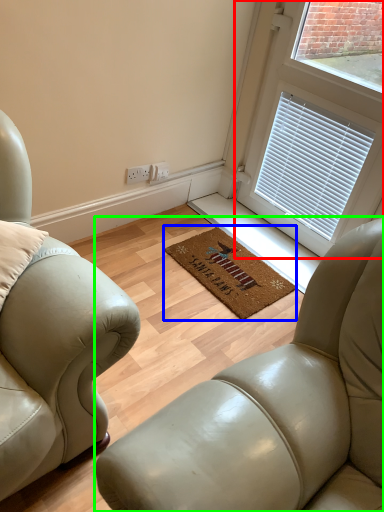
Question: Estimate the real-world distances between objects in this image. Which object is closer to window (highlighted by a red box), mat (highlighted by a blue box) or studio couch (highlighted by a green box)?

Choices:
 (A) mat
 (B) studio couch

Answer: (A)